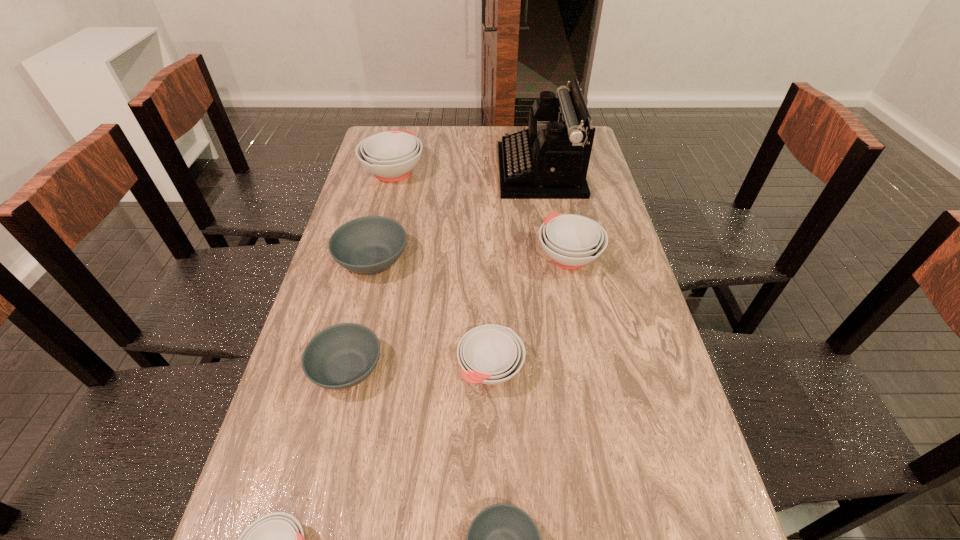
Identify the location of the tallest object. The image size is (960, 540). (549, 160).

The width and height of the screenshot is (960, 540). What are the coordinates of `black typewriter` in the screenshot? It's located at (549, 160).

This screenshot has height=540, width=960. In order to click on the tallest soup bowl in this screenshot , I will do `click(391, 155)`.

In order to click on the seventh shortest object in this screenshot , I will do `click(391, 155)`.

This screenshot has height=540, width=960. I want to click on the third nearest white soup bowl, so click(x=571, y=241).

You are a GUI agent. You are given a task and a screenshot of the screen. Output one action in this format:
    pyautogui.click(x=<x>, y=<y>)
    Task: Click on the second biggest white soup bowl
    
    Given the screenshot: What is the action you would take?
    pyautogui.click(x=571, y=241)

Locate an element on the screen. This screenshot has width=960, height=540. the farthest gray soup bowl is located at coordinates (368, 245).

At what (x,y) coordinates should I click in order to perform the action: click on the third white soup bowl from left to right. Please return your answer as a coordinate pair (x, y). This screenshot has width=960, height=540. Looking at the image, I should click on (490, 354).

At what (x,y) coordinates should I click in order to perform the action: click on the third farthest white soup bowl. Please return your answer as a coordinate pair (x, y). Looking at the image, I should click on (490, 354).

Where is `the second farthest gray soup bowl`? the second farthest gray soup bowl is located at coordinates coord(341,356).